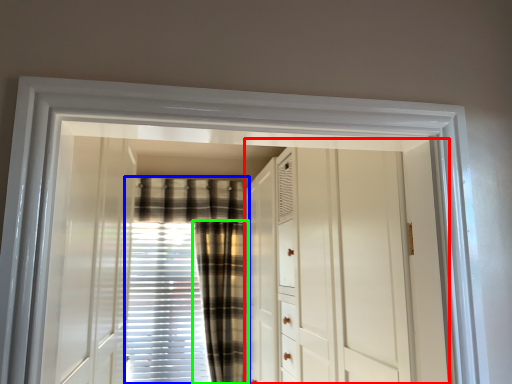
Question: Which object is positioned farthest from dresser (highlighted by a red box)? Select from curtain (highlighted by a blue box) and curtain (highlighted by a green box).

Choices:
 (A) curtain
 (B) curtain

Answer: (A)